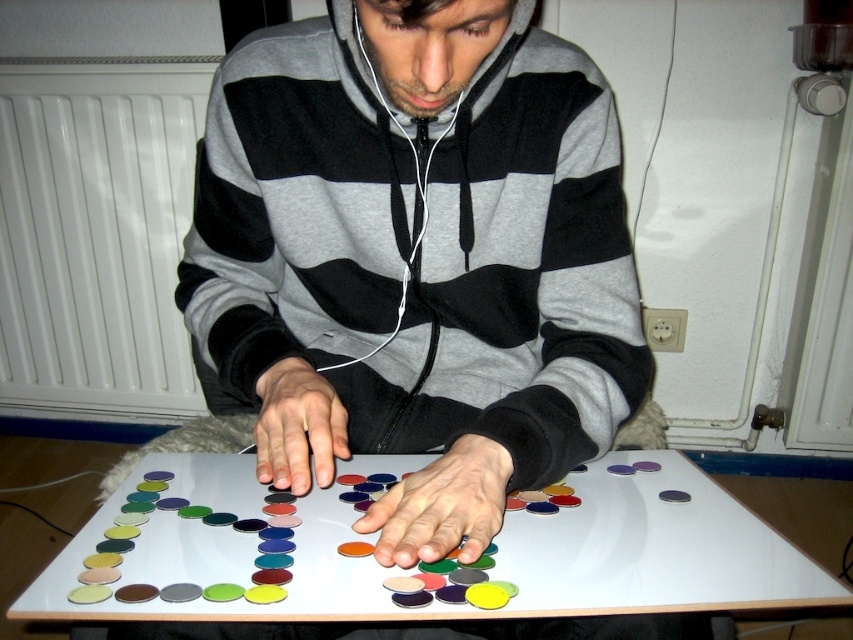
How distant is matte plastic coins at center from matte plastic hand at center?

matte plastic coins at center and matte plastic hand at center are 4.04 inches apart.

Does matte plastic coins at center appear on the left side of matte plastic hand at center?

In fact, matte plastic coins at center is to the right of matte plastic hand at center.

Is point (384, 564) farther from viewer compared to point (271, 369)?

No, it is not.

Where is `matte plastic coins at center`? matte plastic coins at center is located at coordinates (442, 506).

Does point (570, 592) come in front of point (286, 488)?

Yes, point (570, 592) is closer to viewer.

Does point (331, 547) come in front of point (299, 492)?

Yes, point (331, 547) is closer to viewer.

Image resolution: width=853 pixels, height=640 pixels. Find the location of `white glossy table at center`. white glossy table at center is located at coordinates (498, 552).

Does point (24, 307) come closer to viewer compared to point (335, 417)?

No, (24, 307) is behind (335, 417).

Locate an element on the screen. The image size is (853, 640). white matte radiator at left is located at coordinates (96, 236).